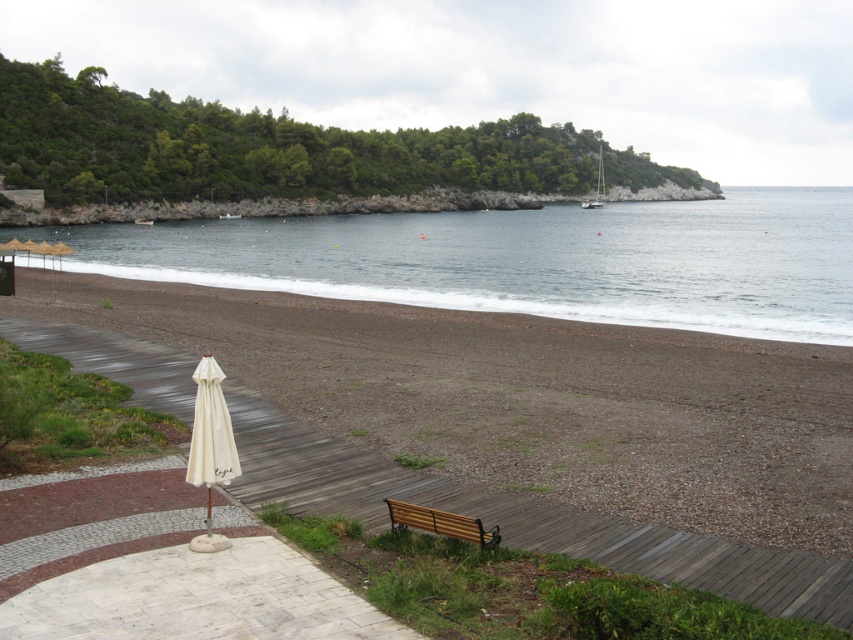
You are planning to set up a small picnic area near the blue water at center and the brown wooden bench at lower center. Which object occupies a bigger space in the image?

The blue water at center is larger in size than the brown wooden bench at lower center, so the blue water at center occupies a bigger space in the image.

You are standing on the beach and want to take a photo of the white fabric umbrella at lower left and the blue water at center. Which object will appear smaller in the photo?

The white fabric umbrella at lower left will appear smaller in the photo because it is farther away from the camera than the blue water at center.

You are standing on the wooden walkway and want to determine which object is higher in elevation between the blue water at center and the brown wooden bench at lower center. Based on the scene, which one is higher?

The blue water at center is much taller than the brown wooden bench at lower center, so the blue water at center is higher in elevation.